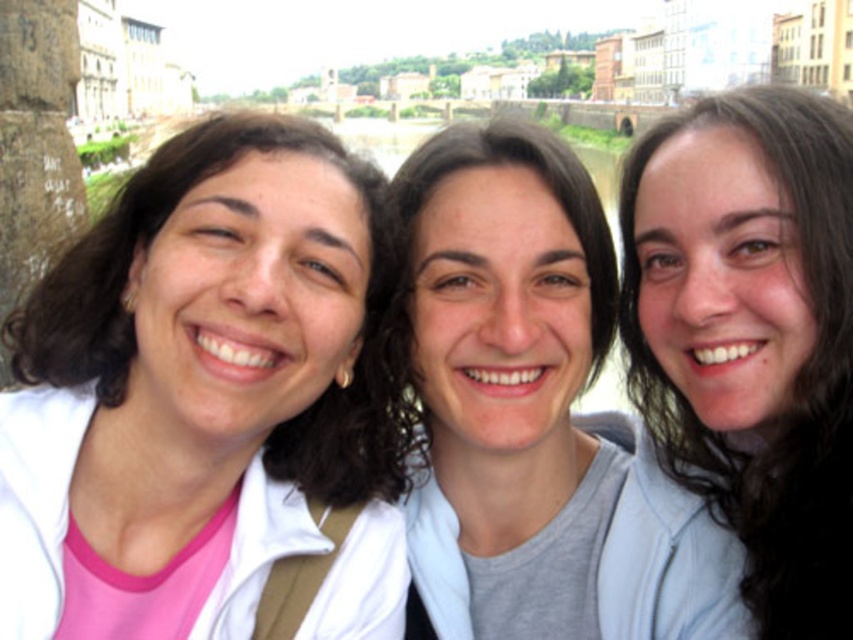
Is white matte jacket at left in front of dark brown hair at center?

Yes.

Between point (193, 531) and point (819, 596), which one is positioned behind?

Point (193, 531)

Image resolution: width=853 pixels, height=640 pixels. Describe the element at coordinates (202, 400) in the screenshot. I see `white matte jacket at left` at that location.

Identify the location of white matte jacket at left. This screenshot has width=853, height=640. (202, 400).

Does matte white shirt at center have a larger size compared to dark brown hair at center?

Yes.

Does point (515, 120) lie behind point (817, 193)?

Yes, point (515, 120) is behind point (817, 193).

You are a GUI agent. You are given a task and a screenshot of the screen. Output one action in this format:
    pyautogui.click(x=<x>, y=<y>)
    Task: Click on the matte white shirt at center
    The image size is (853, 640).
    Given the screenshot: What is the action you would take?
    pyautogui.click(x=531, y=413)

At what (x,y) coordinates should I click in order to perform the action: click on matte white shirt at center. Please return your answer as a coordinate pair (x, y). The height and width of the screenshot is (640, 853). Looking at the image, I should click on (531, 413).

Can you confirm if white matte jacket at left is taller than matte white shirt at center?

No.

Describe the element at coordinates (202, 400) in the screenshot. The width and height of the screenshot is (853, 640). I see `white matte jacket at left` at that location.

Describe the element at coordinates (202, 400) in the screenshot. I see `white matte jacket at left` at that location.

Find the location of `white matte jacket at left`. white matte jacket at left is located at coordinates (202, 400).